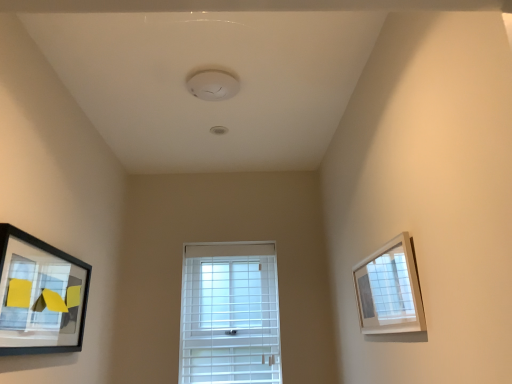
Question: From the image's perspective, is white plastic window at center under white matte picture frame at upper right, acting as the 1th picture frame starting from the right?

Choices:
 (A) yes
 (B) no

Answer: (A)

Question: From a real-world perspective, is white plastic window at center physically below white matte picture frame at upper right, acting as the 1th picture frame starting from the right?

Choices:
 (A) no
 (B) yes

Answer: (B)

Question: Is white plastic window at center outside white matte picture frame at upper right, which ranks as the 2th picture frame in left-to-right order?

Choices:
 (A) no
 (B) yes

Answer: (B)

Question: Can you confirm if white plastic window at center is smaller than white matte picture frame at upper right, acting as the 1th picture frame starting from the right?

Choices:
 (A) yes
 (B) no

Answer: (B)

Question: Does white plastic window at center have a larger size compared to white matte picture frame at upper right, acting as the 1th picture frame starting from the right?

Choices:
 (A) no
 (B) yes

Answer: (B)

Question: Choose the correct answer: Is matte black picture frame at left, positioned as the 1th picture frame in left-to-right order, inside white matte picture frame at upper right, which ranks as the 2th picture frame in left-to-right order, or outside it?

Choices:
 (A) outside
 (B) inside

Answer: (A)

Question: Looking at the image, does matte black picture frame at left, positioned as the 1th picture frame in left-to-right order, seem bigger or smaller compared to white matte picture frame at upper right, which ranks as the 2th picture frame in left-to-right order?

Choices:
 (A) small
 (B) big

Answer: (B)

Question: From a real-world perspective, is matte black picture frame at left, which is counted as the 2th picture frame, starting from the right, positioned above or below white matte picture frame at upper right, which ranks as the 2th picture frame in left-to-right order?

Choices:
 (A) below
 (B) above

Answer: (B)

Question: From the image's perspective, is matte black picture frame at left, which is counted as the 2th picture frame, starting from the right, positioned above or below white matte picture frame at upper right, acting as the 1th picture frame starting from the right?

Choices:
 (A) below
 (B) above

Answer: (A)

Question: From a real-world perspective, is white plastic window at center physically located above or below white matte picture frame at upper right, acting as the 1th picture frame starting from the right?

Choices:
 (A) below
 (B) above

Answer: (A)

Question: In the image, is white plastic window at center positioned in front of or behind white matte picture frame at upper right, which ranks as the 2th picture frame in left-to-right order?

Choices:
 (A) front
 (B) behind

Answer: (B)

Question: Is white plastic window at center bigger or smaller than white matte picture frame at upper right, acting as the 1th picture frame starting from the right?

Choices:
 (A) small
 (B) big

Answer: (B)

Question: Which is correct: white plastic window at center is inside white matte picture frame at upper right, acting as the 1th picture frame starting from the right, or outside of it?

Choices:
 (A) outside
 (B) inside

Answer: (A)

Question: From the image's perspective, is white plastic window at center positioned above or below matte black picture frame at left, positioned as the 1th picture frame in left-to-right order?

Choices:
 (A) above
 (B) below

Answer: (B)

Question: Is white plastic window at center spatially inside matte black picture frame at left, which is counted as the 2th picture frame, starting from the right, or outside of it?

Choices:
 (A) inside
 (B) outside

Answer: (B)